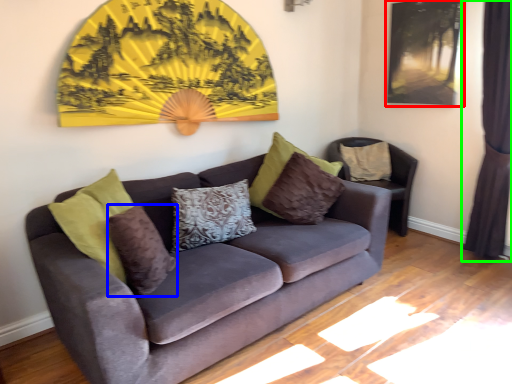
Question: Which object is positioned farthest from picture frame (highlighted by a red box)? Select from pillow (highlighted by a blue box) and curtain (highlighted by a green box).

Choices:
 (A) pillow
 (B) curtain

Answer: (A)